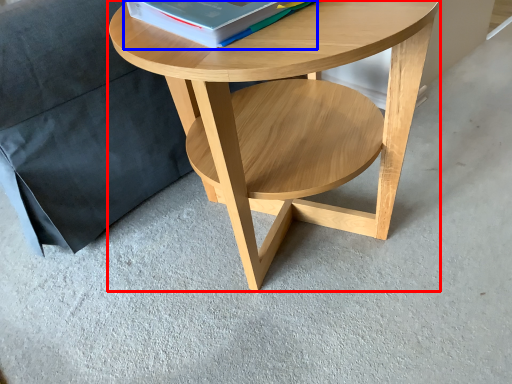
Question: Which object appears farthest to the camera in this image, coffee table (highlighted by a red box) or paperback book (highlighted by a blue box)?

Choices:
 (A) coffee table
 (B) paperback book

Answer: (B)